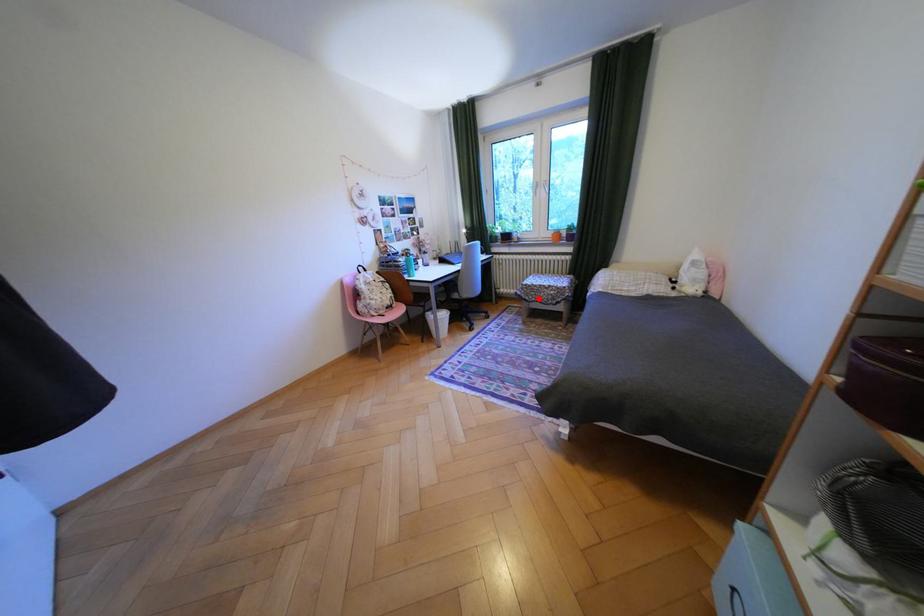
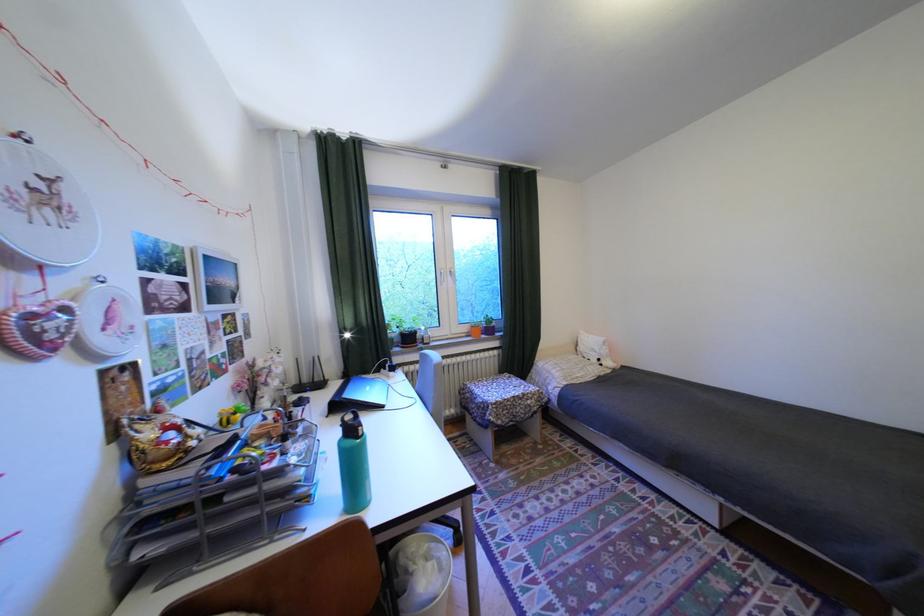
Question: I am providing you with two images of the same scene from different viewpoints. Given a red point in image1, look at the same physical point in image2. Is it:

Choices:
 (A) Closer to the viewpoint
 (B) Farther from the viewpoint

Answer: (B)